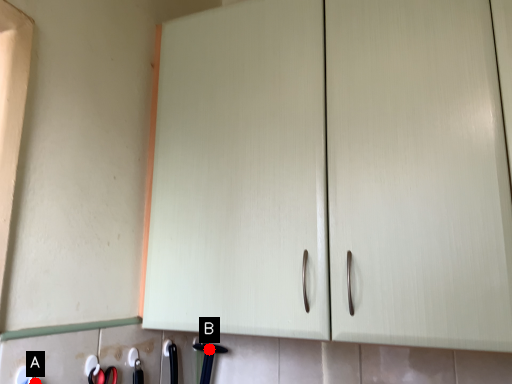
Question: Two points are circled on the image, labeled by A and B beside each circle. Among these points, which one is farthest from the camera?

Choices:
 (A) A is further
 (B) B is further

Answer: (B)